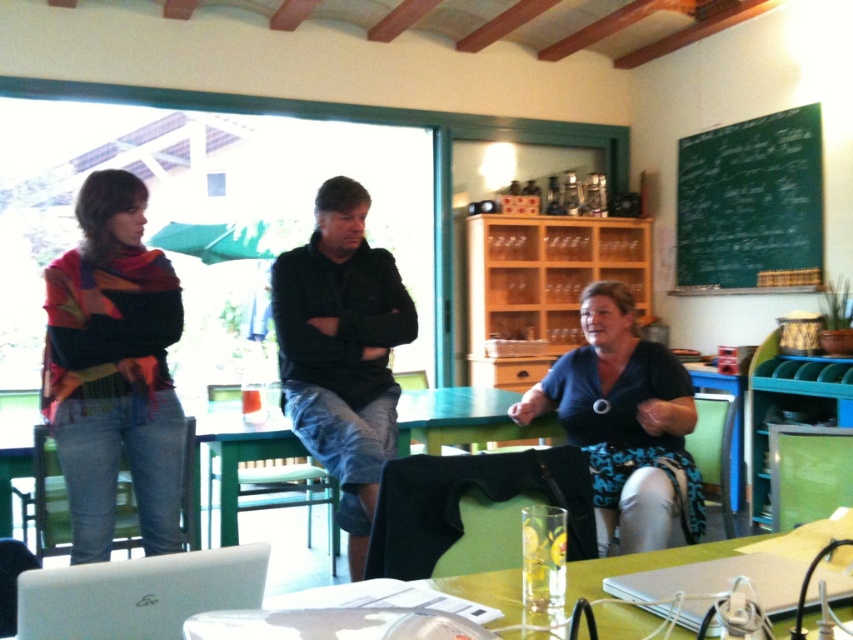
Question: Is black cotton shirt at center below white matte laptop at lower left?

Choices:
 (A) no
 (B) yes

Answer: (A)

Question: Can you confirm if green glossy table at lower center is smaller than white plastic laptop at lower center?

Choices:
 (A) no
 (B) yes

Answer: (A)

Question: Which point appears farthest from the camera in this image?

Choices:
 (A) (595, 378)
 (B) (740, 252)
 (C) (111, 499)
 (D) (648, 554)

Answer: (B)

Question: Does green glossy table at lower center have a smaller size compared to white plastic laptop at lower center?

Choices:
 (A) yes
 (B) no

Answer: (B)

Question: Which of the following is the farthest from the observer?

Choices:
 (A) pyautogui.click(x=659, y=429)
 (B) pyautogui.click(x=787, y=209)

Answer: (B)

Question: Among these points, which one is farthest from the camera?

Choices:
 (A) (335, 426)
 (B) (114, 632)
 (C) (782, 582)
 (D) (680, 394)

Answer: (D)